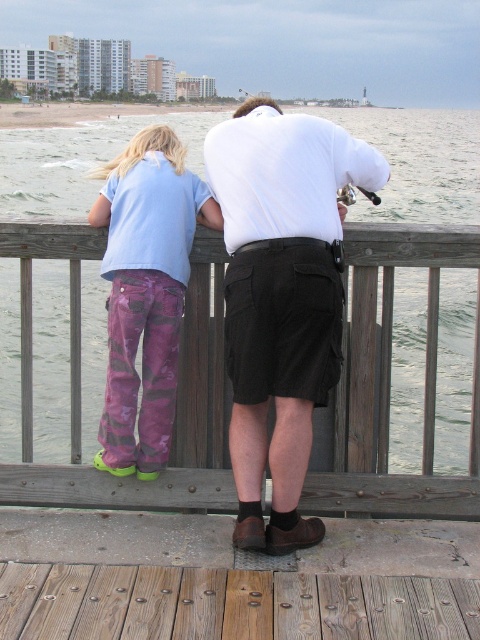
How far apart are light blue cotton shirt at center and wooden rail at center?

light blue cotton shirt at center is 17.06 inches from wooden rail at center.

Who is positioned more to the right, light blue cotton shirt at center or wooden rail at center?

From the viewer's perspective, wooden rail at center appears more on the right side.

At what (x,y) coordinates should I click in order to perform the action: click on light blue cotton shirt at center. Please return your answer as a coordinate pair (x, y). This screenshot has height=640, width=480. Looking at the image, I should click on (282, 298).

Between wooden rail at center and wooden planks at lower center, which one appears on the right side from the viewer's perspective?

Positioned to the right is wooden rail at center.

This screenshot has height=640, width=480. What do you see at coordinates (391, 342) in the screenshot?
I see `wooden rail at center` at bounding box center [391, 342].

Identify the location of wooden rail at center. This screenshot has height=640, width=480. (391, 342).

Measure the distance from wooden planks at lower center to camouflage pants at left.

The distance of wooden planks at lower center from camouflage pants at left is 37.57 inches.

Which of these two, wooden planks at lower center or camouflage pants at left, stands shorter?

With less height is wooden planks at lower center.

Is point (257, 579) farther from camera compared to point (155, 163)?

No, it is in front of (155, 163).

The image size is (480, 640). I want to click on wooden planks at lower center, so coord(228,604).